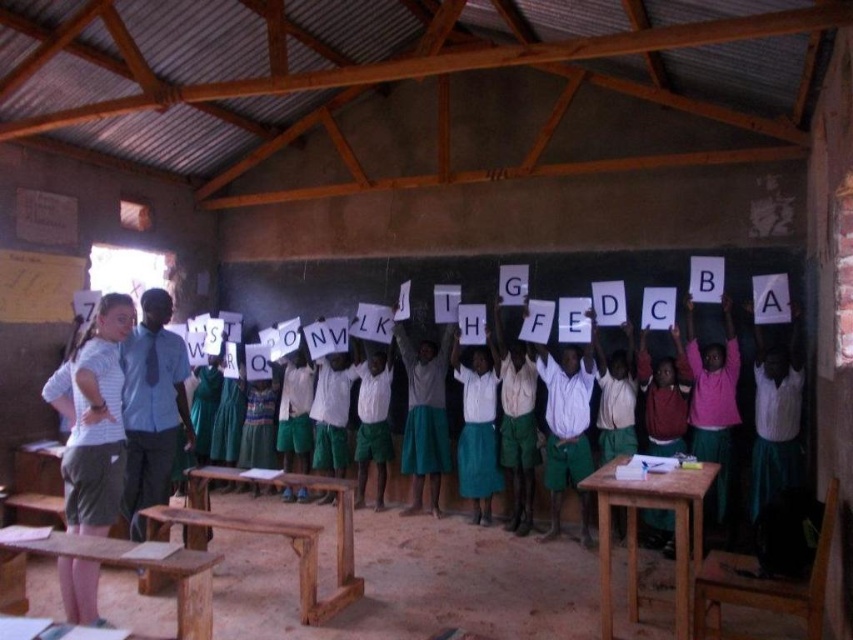
Does point (480, 282) lie behind point (685, 586)?

That is True.

I want to click on white paper letters at center, so click(x=432, y=282).

Who is higher up, white striped shirt at left or green skirt at center?

green skirt at center

Is point (94, 476) positioned in front of point (688, 388)?

Yes, it is.

In order to click on white striped shirt at left in this screenshot , I will do `click(93, 419)`.

Which of these two, white paper letters at center or white cotton shirt at center, stands shorter?

Standing shorter between the two is white paper letters at center.

Can you confirm if white paper letters at center is shorter than white cotton shirt at center?

Yes, white paper letters at center is shorter than white cotton shirt at center.

Locate an element on the screen. The width and height of the screenshot is (853, 640). white paper letters at center is located at coordinates (432, 282).